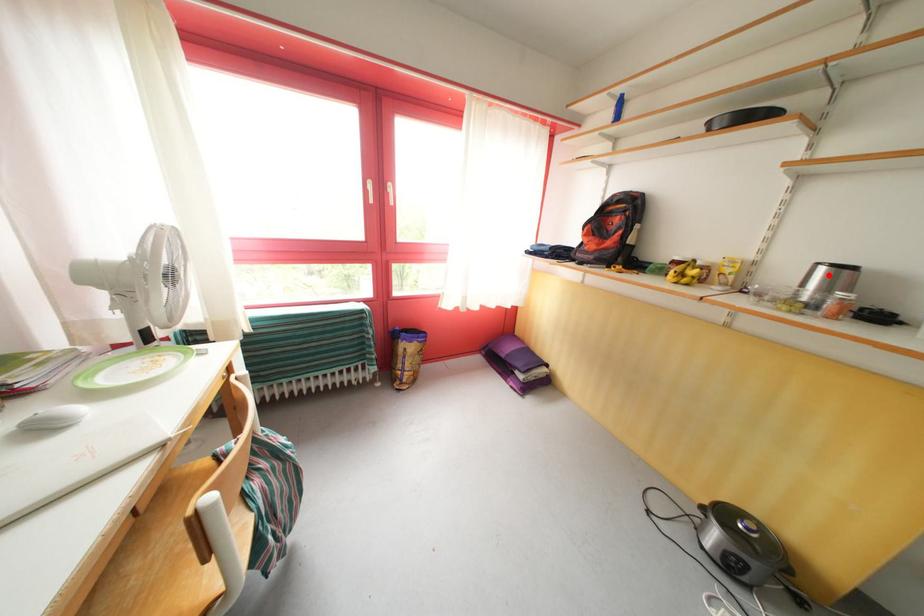
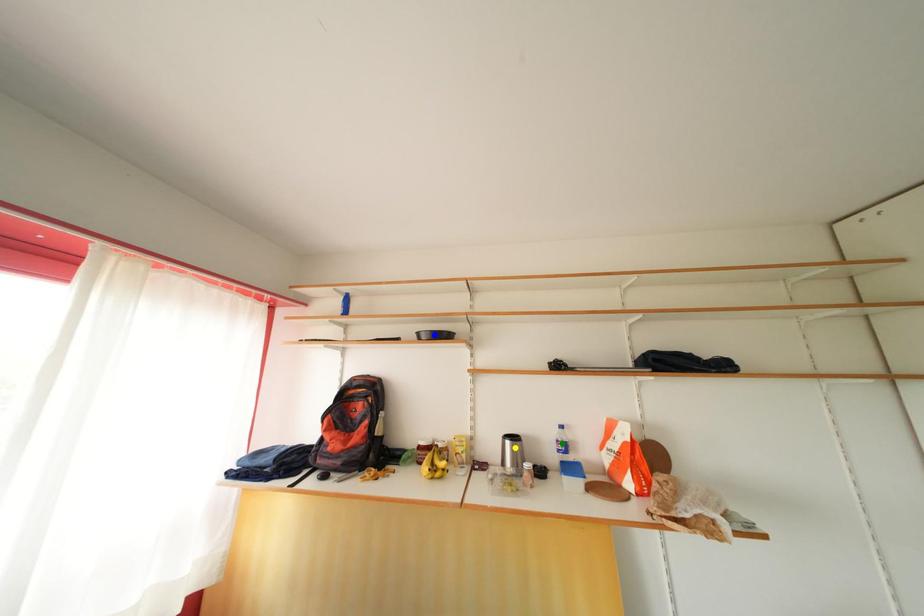
Question: I am providing you with two images of the same scene from different viewpoints. A red point is marked on the first image. You are given multiple points on the second image. Which mark in image 2 goes with the point in image 1?

Choices:
 (A) green point
 (B) blue point
 (C) yellow point

Answer: (C)